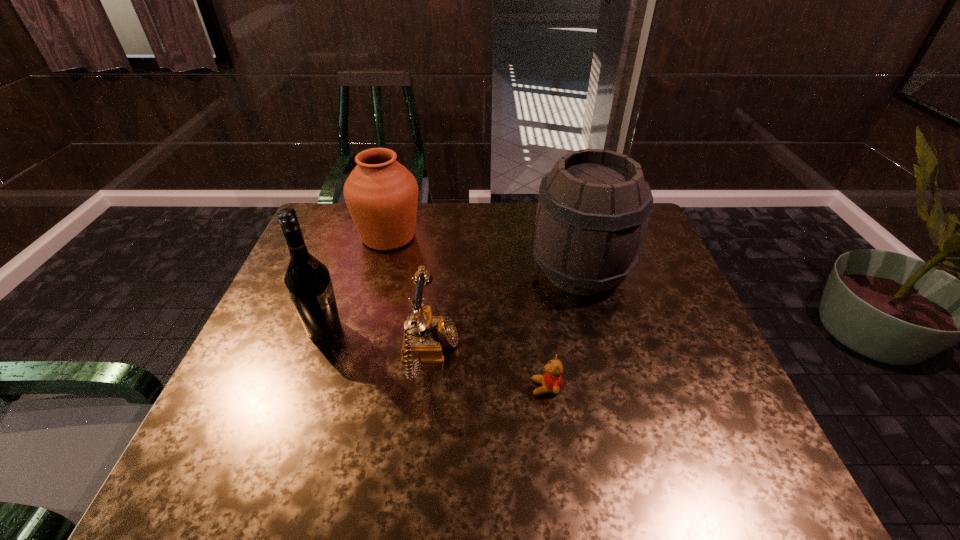
Locate an element on the screen. blank space at the near edge is located at coordinates (591, 482).

Where is `vacant space at the left edge`? The width and height of the screenshot is (960, 540). vacant space at the left edge is located at coordinates (276, 426).

Locate an element on the screen. The height and width of the screenshot is (540, 960). vacant space at the near right corner of the desktop is located at coordinates (784, 491).

You are a GUI agent. You are given a task and a screenshot of the screen. Output one action in this format:
    pyautogui.click(x=<x>, y=<y>)
    Task: Click on the vacant region between the urn and the wine bucket
    Image resolution: width=960 pixels, height=540 pixels.
    Given the screenshot: What is the action you would take?
    pyautogui.click(x=485, y=254)

Locate an element on the screen. The width and height of the screenshot is (960, 540). vacant space that's between the telephone and the teddy bear is located at coordinates (489, 371).

The width and height of the screenshot is (960, 540). I want to click on empty space between the wine bottle and the telephone, so click(377, 341).

Where is `free space between the telephone and the wine bucket`? The image size is (960, 540). free space between the telephone and the wine bucket is located at coordinates (505, 313).

This screenshot has width=960, height=540. I want to click on free spot between the shortest object and the urn, so click(468, 312).

Image resolution: width=960 pixels, height=540 pixels. Find the location of `blank region between the wine bucket and the teddy bear`. blank region between the wine bucket and the teddy bear is located at coordinates (564, 329).

The width and height of the screenshot is (960, 540). I want to click on free space between the wine bucket and the urn, so click(485, 254).